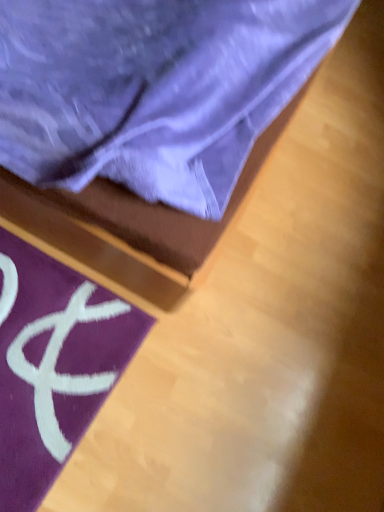
Find the location of `blank space situated above wooden bed frame at upper left (from a real-world perspective)`. blank space situated above wooden bed frame at upper left (from a real-world perspective) is located at coordinates (260, 297).